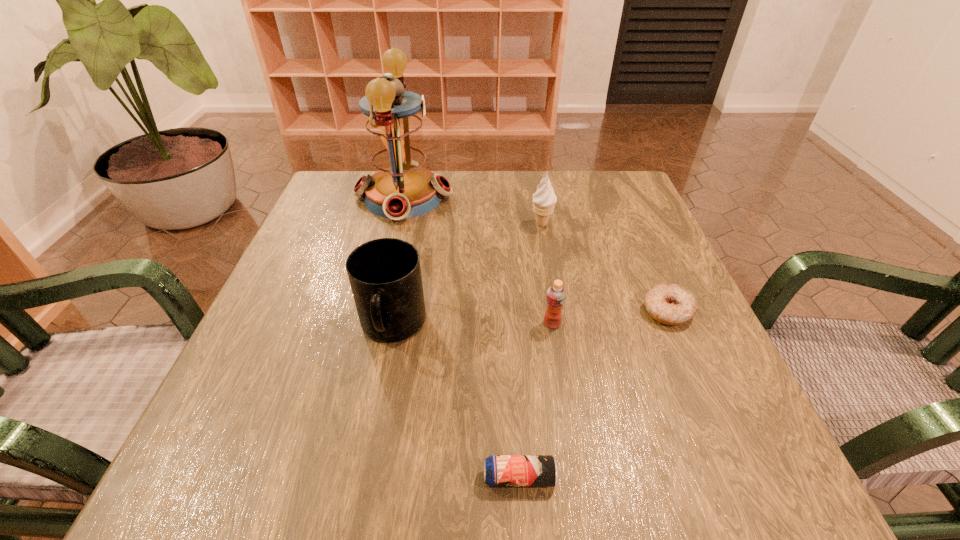
The height and width of the screenshot is (540, 960). Identify the location of vacant space in between the third object from left to right and the mug. (456, 402).

Where is `free space between the icecream and the mug`? free space between the icecream and the mug is located at coordinates (468, 276).

Find the location of a particular element. The height and width of the screenshot is (540, 960). unoccupied position between the tallest object and the icecream is located at coordinates (472, 210).

This screenshot has width=960, height=540. What are the coordinates of `vacant space that is in between the doughnut and the third shortest object` in the screenshot? It's located at (610, 317).

The width and height of the screenshot is (960, 540). Find the location of `free space between the rightmost object and the third shortest object`. free space between the rightmost object and the third shortest object is located at coordinates (610, 317).

Select which object appears as the closest to the third shortest object. Please provide its 2D coordinates. Your answer should be formatted as a tuple, i.e. [(x, y)], where the tuple contains the x and y coordinates of a point satisfying the conditions above.

[(667, 303)]

The width and height of the screenshot is (960, 540). What are the coordinates of `object that stands as the fifth closest to the third object from left to right` in the screenshot? It's located at (401, 187).

Locate an element on the screen. Image resolution: width=960 pixels, height=540 pixels. blank space that satisfies the following two spatial constraints: 1. on the front-facing side of the third shortest object; 2. on the right side of the lantern is located at coordinates pos(373,323).

I want to click on vacant position in the image that satisfies the following two spatial constraints: 1. on the front-facing side of the lantern; 2. on the back side of the doughnut, so click(376, 311).

I want to click on vacant area in the image that satisfies the following two spatial constraints: 1. on the side of the nearest object with the handle; 2. on the right side of the mug, so click(363, 477).